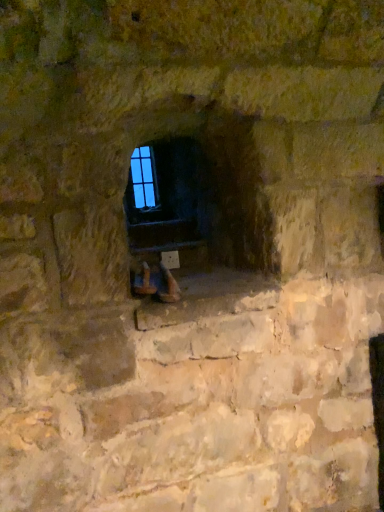
Question: Should I look upward or downward to see blue glass window at center?

Choices:
 (A) down
 (B) up

Answer: (B)

Question: Is smooth stone fireplace at center not close to blue glass window at center?

Choices:
 (A) yes
 (B) no

Answer: (B)

Question: Is the position of smooth stone fireplace at center less distant than that of blue glass window at center?

Choices:
 (A) no
 (B) yes

Answer: (B)

Question: Can blue glass window at center be found inside smooth stone fireplace at center?

Choices:
 (A) no
 (B) yes

Answer: (A)

Question: From the image's perspective, is smooth stone fireplace at center located above blue glass window at center?

Choices:
 (A) yes
 (B) no

Answer: (B)

Question: Would you say smooth stone fireplace at center is outside blue glass window at center?

Choices:
 (A) no
 (B) yes

Answer: (B)

Question: From the image's perspective, does smooth stone fireplace at center appear lower than blue glass window at center?

Choices:
 (A) no
 (B) yes

Answer: (B)

Question: Is blue glass window at center further to the viewer compared to smooth stone fireplace at center?

Choices:
 (A) no
 (B) yes

Answer: (B)

Question: Is blue glass window at center at the left side of smooth stone fireplace at center?

Choices:
 (A) yes
 (B) no

Answer: (A)

Question: Is blue glass window at center thinner than smooth stone fireplace at center?

Choices:
 (A) no
 (B) yes

Answer: (B)

Question: Is blue glass window at center far away from smooth stone fireplace at center?

Choices:
 (A) yes
 (B) no

Answer: (B)

Question: Can smooth stone fireplace at center be found inside blue glass window at center?

Choices:
 (A) no
 (B) yes

Answer: (A)

Question: From the image's perspective, is blue glass window at center under smooth stone fireplace at center?

Choices:
 (A) no
 (B) yes

Answer: (A)

Question: From the image's perspective, is smooth stone fireplace at center positioned above or below blue glass window at center?

Choices:
 (A) above
 (B) below

Answer: (B)